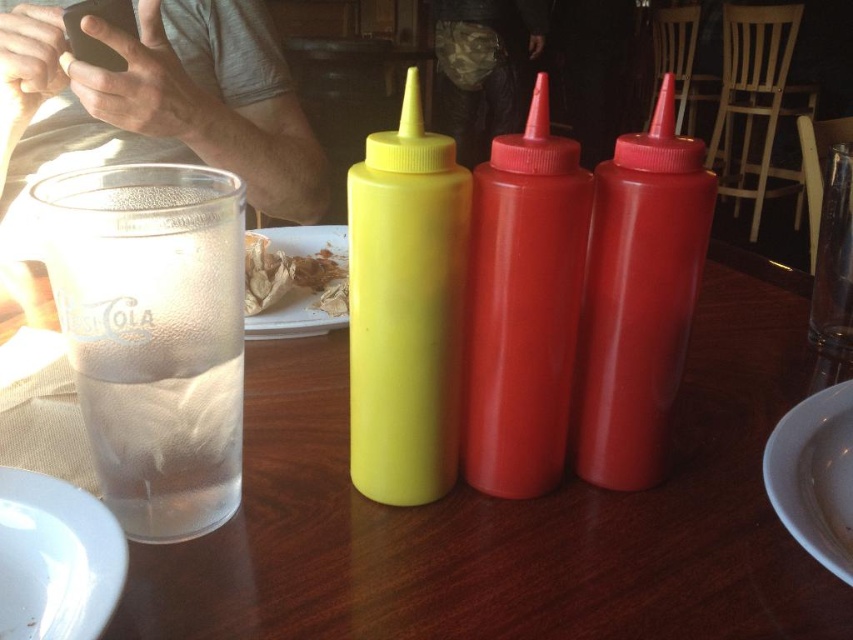
Question: Is white ceramic plate at lower right wider than white paper plate at center?

Choices:
 (A) yes
 (B) no

Answer: (B)

Question: Which point is closer to the camera?

Choices:
 (A) brown crumpled paper at center
 (B) white ceramic plate at lower right

Answer: (B)

Question: Is white glossy plate at lower left thinner than brown crumpled paper at center?

Choices:
 (A) yes
 (B) no

Answer: (B)

Question: Which object is positioned farthest from the white paper plate at center?

Choices:
 (A) matte plastic condiment bottles at center
 (B) clear glass cup at left
 (C) white glossy plate at lower left
 (D) white ceramic plate at lower right

Answer: (D)

Question: Among these objects, which one is farthest from the camera?

Choices:
 (A) clear glass cup at left
 (B) white ceramic plate at lower right

Answer: (B)

Question: Is yellow matte plastic mustard at center to the left of white paper plate at center from the viewer's perspective?

Choices:
 (A) yes
 (B) no

Answer: (B)